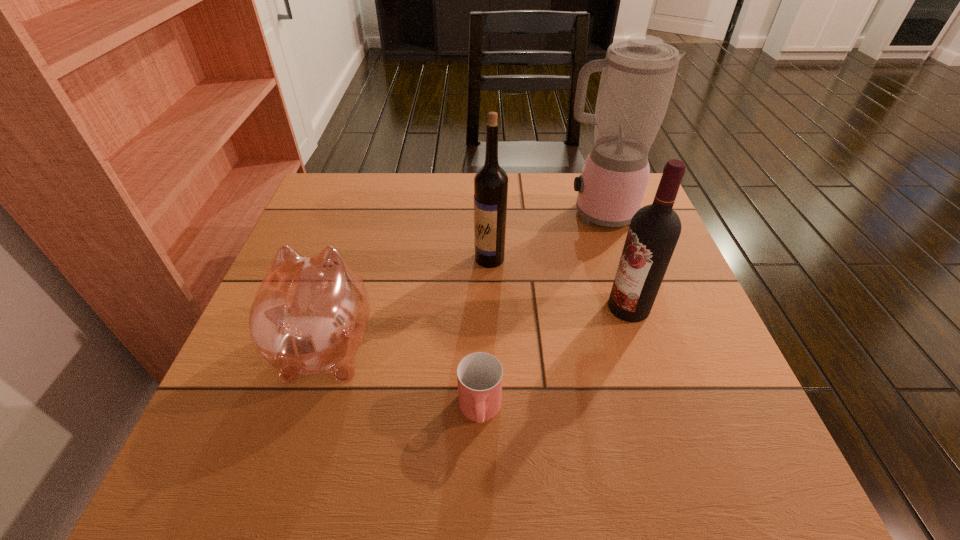
You are a GUI agent. You are given a task and a screenshot of the screen. Output one action in this format:
    pyautogui.click(x=<x>, y=<y>)
    Task: Click on the free spot between the nearer wine bottle and the food processor
    This screenshot has width=960, height=540.
    Given the screenshot: What is the action you would take?
    pyautogui.click(x=613, y=260)

Where is `vacant point located between the nearer wine bottle and the shortest object`? Image resolution: width=960 pixels, height=540 pixels. vacant point located between the nearer wine bottle and the shortest object is located at coordinates (554, 360).

You are a GUI agent. You are given a task and a screenshot of the screen. Output one action in this format:
    pyautogui.click(x=<x>, y=<y>)
    Task: Click on the object that is the closest to the farthest object
    
    Given the screenshot: What is the action you would take?
    pyautogui.click(x=490, y=182)

Locate an element on the screen. The width and height of the screenshot is (960, 540). object that is the fourth closest to the piggy bank is located at coordinates (638, 74).

This screenshot has width=960, height=540. I want to click on free location that satisfies the following two spatial constraints: 1. on the label of the left wine bottle; 2. on the side of the shortest object with the handle, so click(x=493, y=411).

Locate an element on the screen. Image resolution: width=960 pixels, height=540 pixels. vacant region that satisfies the following two spatial constraints: 1. on the label of the right wine bottle; 2. on the side of the cup with the handle is located at coordinates (662, 411).